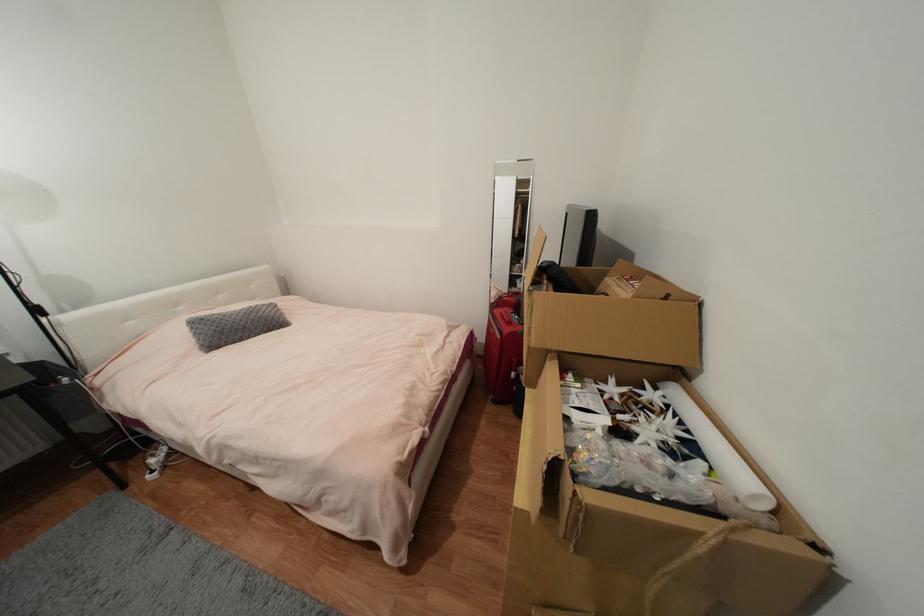
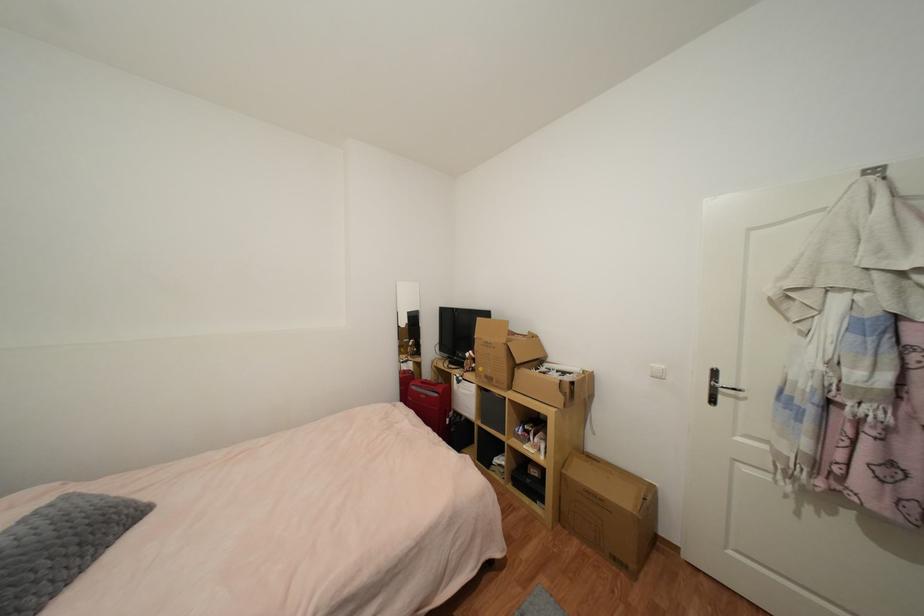
Where in the second image is the point corresponding to [503,338] from the first image?

(440, 397)